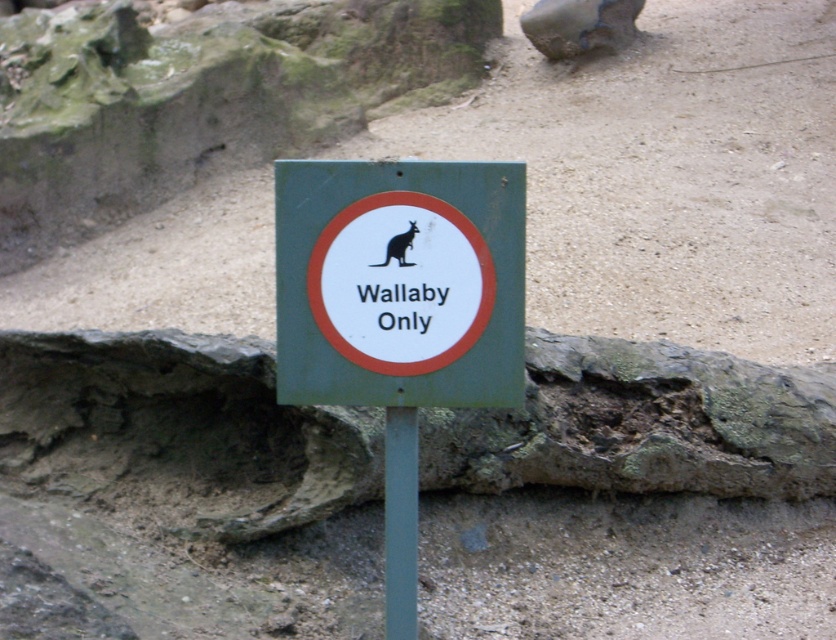
Question: Can you confirm if green matte sign at center is positioned to the left of green metallic pole at center?

Choices:
 (A) yes
 (B) no

Answer: (B)

Question: Is green metallic pole at center wider than brown fur wallaby at center?

Choices:
 (A) no
 (B) yes

Answer: (A)

Question: From the image, what is the correct spatial relationship of green metallic pole at center in relation to brown fur wallaby at center?

Choices:
 (A) below
 (B) above

Answer: (A)

Question: Which of the following is the closest to the observer?

Choices:
 (A) green matte sign at center
 (B) green metallic pole at center

Answer: (A)

Question: Among these points, which one is farthest from the camera?

Choices:
 (A) (385, 576)
 (B) (498, 364)

Answer: (A)

Question: Which of the following is the farthest from the observer?

Choices:
 (A) brown fur wallaby at center
 (B) green matte sign at center
 (C) green metallic pole at center

Answer: (C)